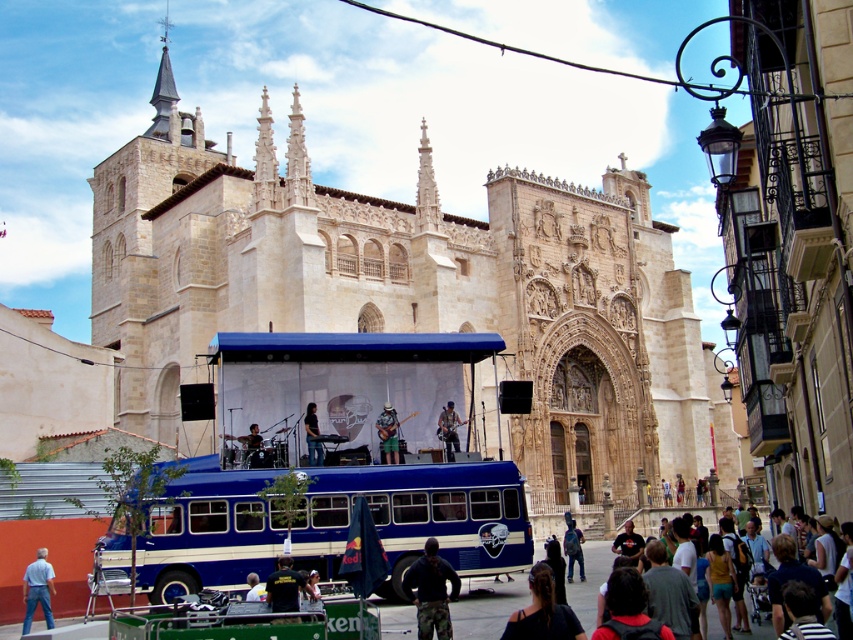
In the scene shown: Which is more to the left, red backpack at center or matte black drum set at center?

matte black drum set at center is more to the left.

Which is more to the right, red backpack at center or matte black drum set at center?

red backpack at center

You are a GUI agent. You are given a task and a screenshot of the screen. Output one action in this format:
    pyautogui.click(x=<x>, y=<y>)
    Task: Click on the red backpack at center
    This screenshot has height=640, width=853.
    Given the screenshot: What is the action you would take?
    pyautogui.click(x=625, y=596)

Who is more distant from viewer, (x=380, y=428) or (x=254, y=589)?

The point (x=380, y=428) is behind.

The height and width of the screenshot is (640, 853). Describe the element at coordinates (387, 433) in the screenshot. I see `camouflage pants at center` at that location.

Find the location of `camouflage pants at center`. camouflage pants at center is located at coordinates (387, 433).

At what (x,y) coordinates should I click in order to perform the action: click on blue metallic bus at center. Please return your answer as a coordinate pair (x, y). The image size is (853, 640). Looking at the image, I should click on (416, 516).